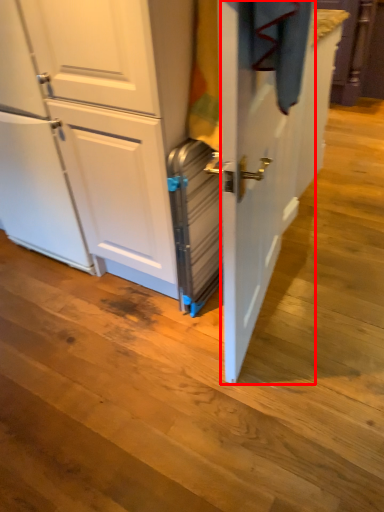
Question: Considering the relative positions of screen door (annotated by the red box) and appliance in the image provided, where is screen door (annotated by the red box) located with respect to the staircase?

Choices:
 (A) left
 (B) right

Answer: (B)